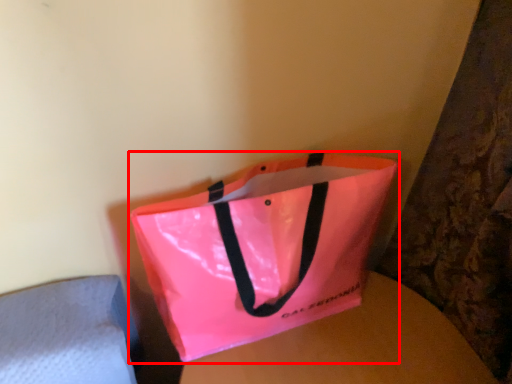
Question: From the image's perspective, what is the correct spatial positioning of handbag (annotated by the red box) in reference to round table?

Choices:
 (A) below
 (B) above

Answer: (B)